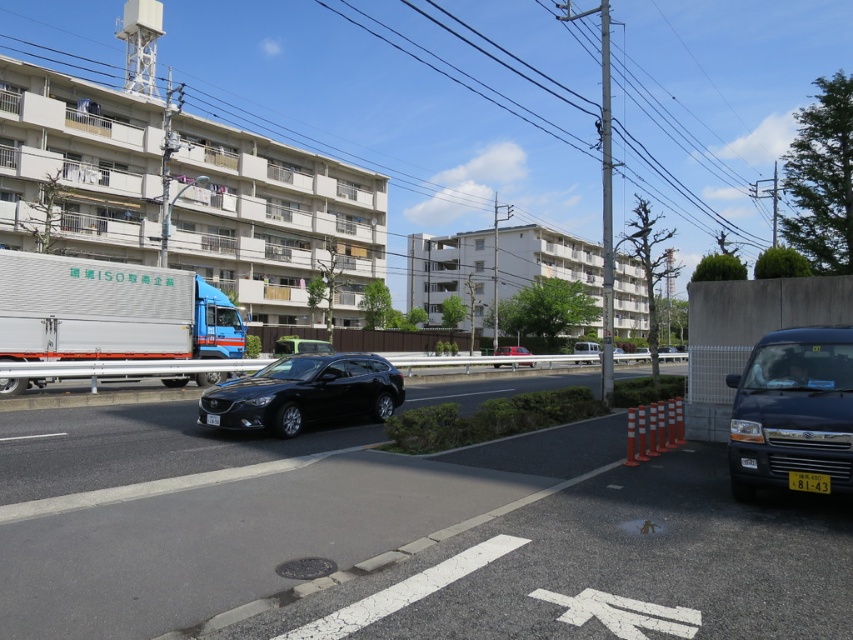
You are a pedestrian standing at the edge of the road. You need to cross the road to reach the buildings in the middle ground. There is a black matte hatchback at center and a green plastic barrier at center in your way. Which object should you move around first?

You should move around the black matte hatchback at center first because it is closer to you than the green plastic barrier at center.

You are standing at the center of the image looking towards the black car parked on the right side. Which direction should you turn to locate the yellow plastic license plate at lower right?

The yellow plastic license plate at lower right is located at point (809, 481), which is to your right side. Therefore, you should turn to your right to locate it.